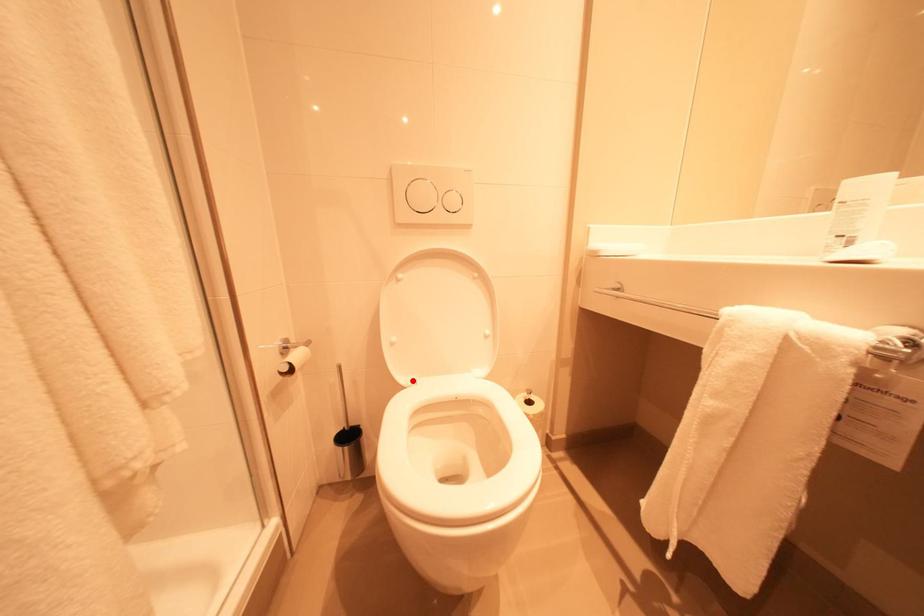
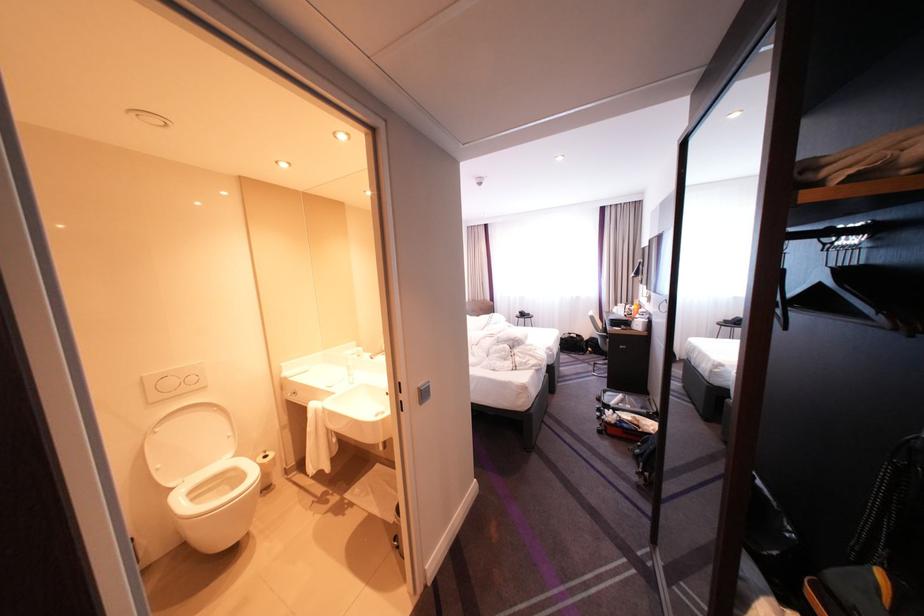
Locate, in the second image, the point that corresponds to the highlighted location in the first image.

(183, 485)